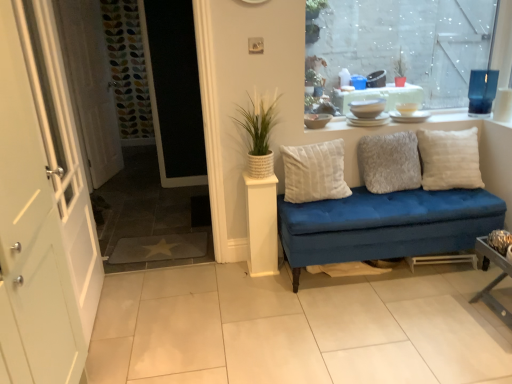
This screenshot has width=512, height=384. Find the location of `vacant point above white tile at center (from a real-world perspective)`. vacant point above white tile at center (from a real-world perspective) is located at coordinates (337, 316).